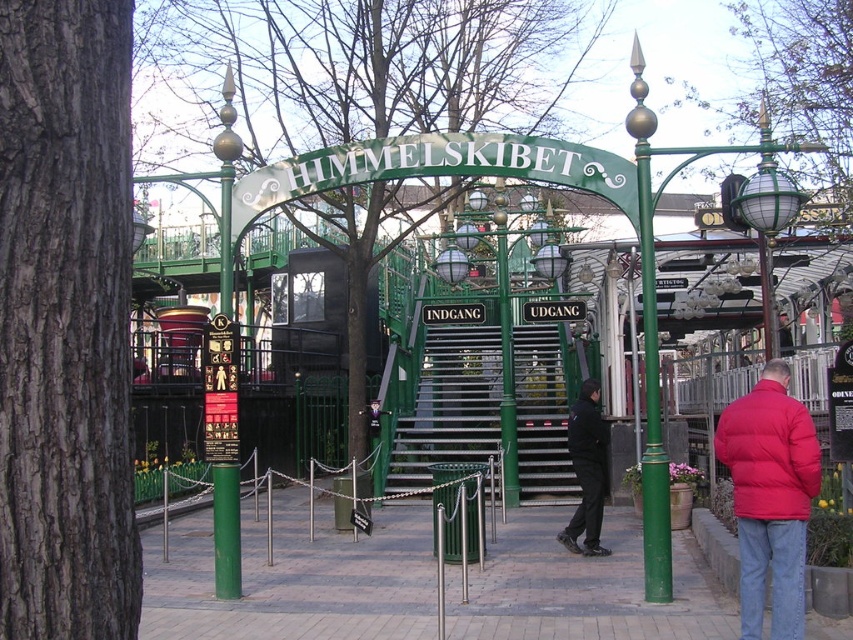
You are a visitor at the Himmelskibet attraction and want to find the entrance. You see a red puffy jacket at lower right and a dark blue jacket at center. Which jacket is closer to the entrance sign labeled

The red puffy jacket at lower right is above the dark blue jacket at center, so it is closer to the entrance sign labeled

You are standing at the base of the green metallic stairs at center in front of the Himmelskibet attraction. To reach the entrance marked with the sign INDGANG, should you climb up or go down the stairs?

You should climb up the green metallic stairs at center to reach the entrance marked with the sign INDGANG because the stairs are positioned at point (491, 410), which is above the base level.